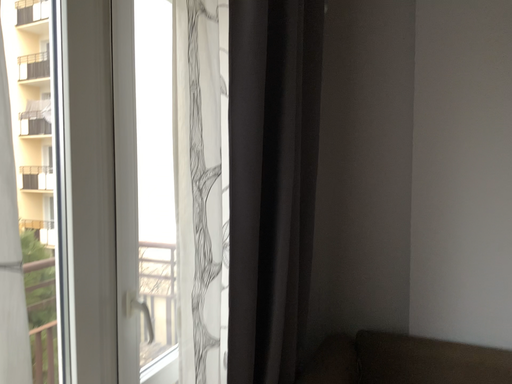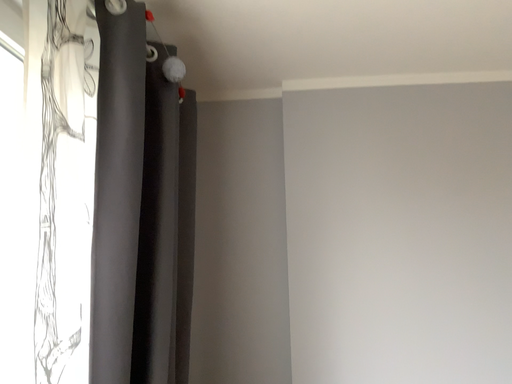
Question: Which way did the camera rotate in the video?

Choices:
 (A) rotated left
 (B) rotated right

Answer: (B)